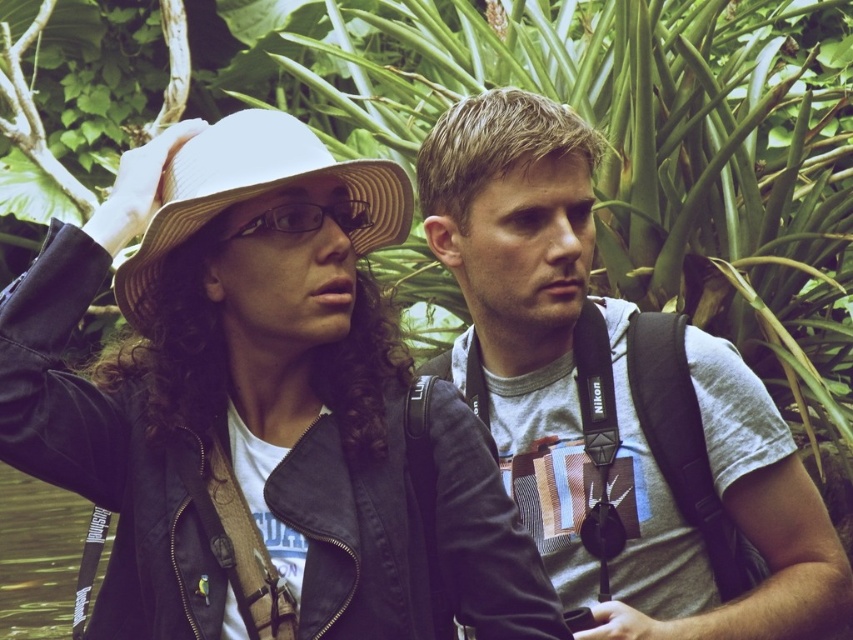
Question: Which is farther from the gray cotton t-shirt at center?

Choices:
 (A) transparent plastic water at lower left
 (B) white woven hat at left
 (C) matte white hat at left

Answer: (A)

Question: Is matte white hat at left positioned at the back of white woven hat at left?

Choices:
 (A) yes
 (B) no

Answer: (A)

Question: Which object is farther from the camera taking this photo?

Choices:
 (A) white woven hat at left
 (B) matte white hat at left
 (C) transparent plastic water at lower left
 (D) gray cotton t-shirt at center

Answer: (C)

Question: From the image, what is the correct spatial relationship of white woven hat at left in relation to transparent plastic water at lower left?

Choices:
 (A) above
 (B) below

Answer: (A)

Question: Can you confirm if white woven hat at left is smaller than transparent plastic water at lower left?

Choices:
 (A) no
 (B) yes

Answer: (A)

Question: Based on their relative distances, which object is farther from the transparent plastic water at lower left?

Choices:
 (A) gray cotton t-shirt at center
 (B) white woven hat at left

Answer: (B)